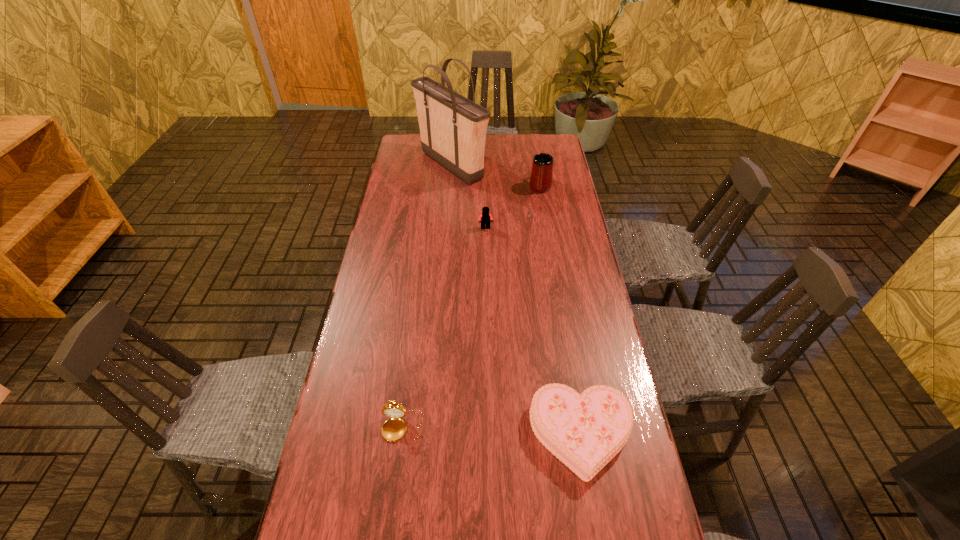
Where is `free space located 0.100m on the face of the pocket watch`? free space located 0.100m on the face of the pocket watch is located at coordinates (396, 486).

The height and width of the screenshot is (540, 960). I want to click on vacant space located on the back of the cake, so click(570, 367).

The width and height of the screenshot is (960, 540). What are the coordinates of `object that is positioned at the far edge` in the screenshot? It's located at (453, 128).

The image size is (960, 540). Find the location of `shopping bag positioned at the left edge`. shopping bag positioned at the left edge is located at coordinates (453, 128).

What are the coordinates of `pocket watch present at the left edge` in the screenshot? It's located at (394, 429).

Find the location of a particular element. The width and height of the screenshot is (960, 540). mug that is at the right edge is located at coordinates (541, 175).

Locate an element on the screen. The image size is (960, 540). cake located in the right edge section of the desktop is located at coordinates tap(586, 431).

Image resolution: width=960 pixels, height=540 pixels. Find the location of `object that is at the far left corner`. object that is at the far left corner is located at coordinates (453, 128).

Locate an element on the screen. Image resolution: width=960 pixels, height=540 pixels. free space at the far edge of the desktop is located at coordinates (499, 139).

In the image, there is a desktop. Where is `free space at the left edge`? free space at the left edge is located at coordinates tap(350, 367).